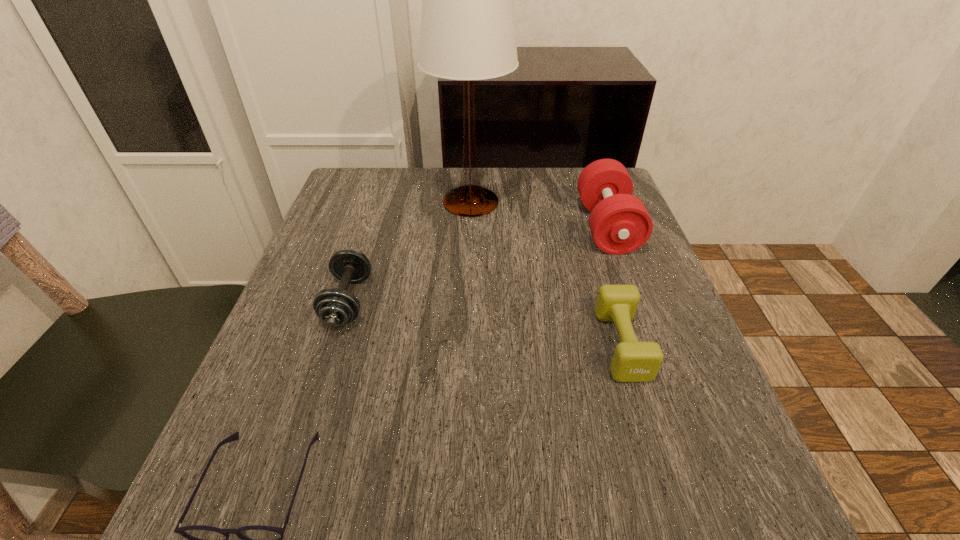
The width and height of the screenshot is (960, 540). I want to click on table lamp, so click(x=467, y=33).

The width and height of the screenshot is (960, 540). I want to click on the third object from left to right, so click(x=467, y=33).

This screenshot has width=960, height=540. Find the location of `the fourth shortest object`. the fourth shortest object is located at coordinates (619, 222).

You are a GUI agent. You are given a task and a screenshot of the screen. Output one action in this format:
    pyautogui.click(x=<x>, y=<y>)
    Task: Click on the farthest dumbbell
    
    Given the screenshot: What is the action you would take?
    tap(619, 222)

Identify the location of the leftmost dumbbell. (335, 307).

Locate an element on the screen. vacant space located above the cylindrical shade of the third object from right to left is located at coordinates (468, 277).

This screenshot has width=960, height=540. Find the location of `free space located on the front of the farthest dumbbell`. free space located on the front of the farthest dumbbell is located at coordinates (628, 283).

Where is `vacant space located on the back of the leftmost dumbbell`? vacant space located on the back of the leftmost dumbbell is located at coordinates [x=384, y=186].

The image size is (960, 540). Find the location of `table lamp present at the far edge`. table lamp present at the far edge is located at coordinates (467, 33).

Find the location of a particular element. dumbbell that is at the far edge is located at coordinates (619, 222).